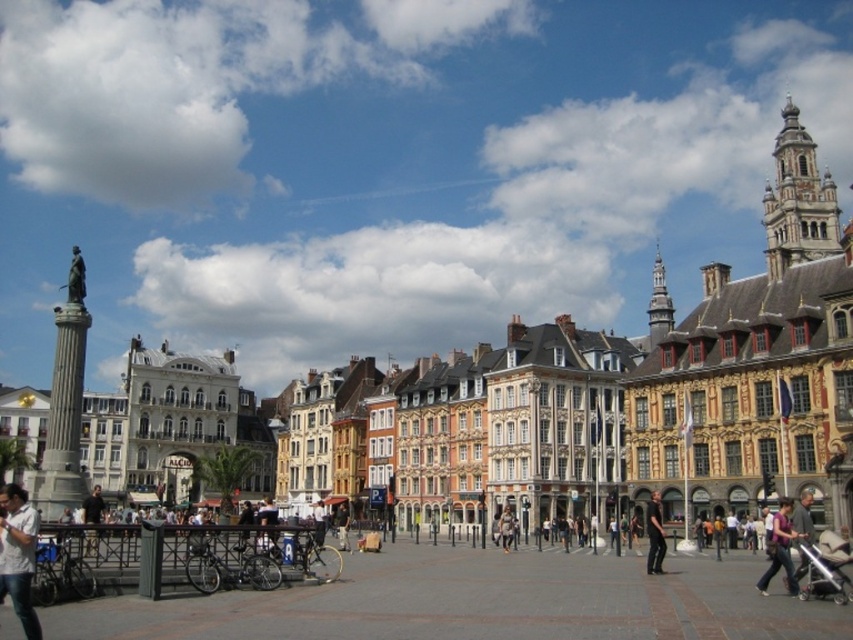
Who is positioned more to the left, matte stone statue at left or dark gray fabric jacket at lower right?

Positioned to the left is dark gray fabric jacket at lower right.

Does matte stone statue at left appear on the right side of dark gray fabric jacket at lower right?

Indeed, matte stone statue at left is positioned on the right side of dark gray fabric jacket at lower right.

Between point (560, 316) and point (650, 557), which one is positioned behind?

Point (560, 316)

In order to click on matte stone statue at left in this screenshot , I will do `click(752, 358)`.

The height and width of the screenshot is (640, 853). What do you see at coordinates (18, 556) in the screenshot?
I see `white cotton shirt at lower left` at bounding box center [18, 556].

Does white cotton shirt at lower left appear under matte purple shirt at center?

Yes, white cotton shirt at lower left is below matte purple shirt at center.

Who is more forward, [18,540] or [757,584]?

Point [18,540] is more forward.

At what (x,y) coordinates should I click in order to perform the action: click on white cotton shirt at lower left. Please return your answer as a coordinate pair (x, y). Looking at the image, I should click on (18, 556).

Can you confirm if dark gray fabric jacket at lower right is bigger than light brown leather jacket at center?

Indeed, dark gray fabric jacket at lower right has a larger size compared to light brown leather jacket at center.

Who is more distant from viewer, (654, 522) or (509, 532)?

The point (509, 532) is behind.

Between point (660, 512) and point (503, 538), which one is positioned in front?

Point (660, 512)

The image size is (853, 640). Identify the location of dark gray fabric jacket at lower right. (654, 534).